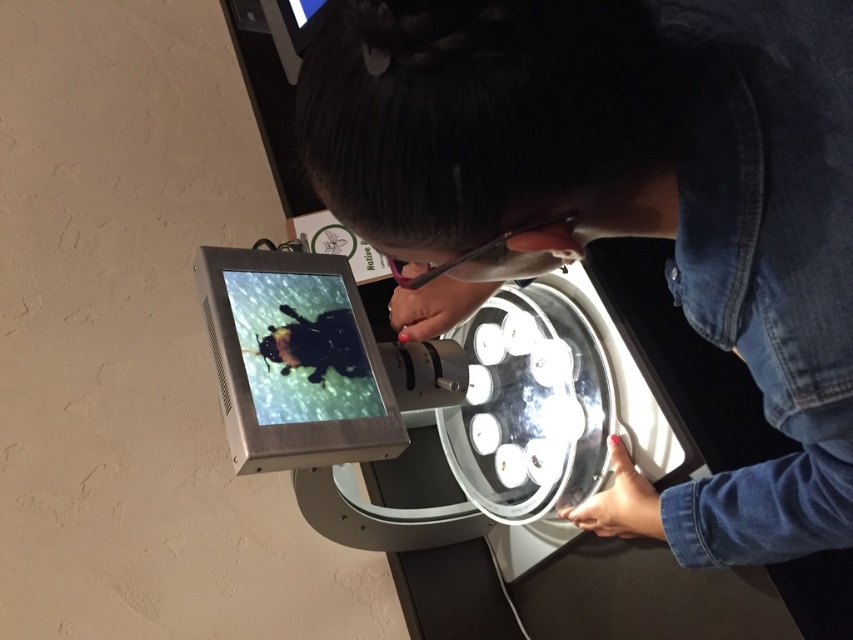
Question: Considering the relative positions of denim jacket at center and matte black screen at center in the image provided, where is denim jacket at center located with respect to matte black screen at center?

Choices:
 (A) below
 (B) above

Answer: (B)

Question: Can you confirm if denim jacket at center is positioned to the right of matte black screen at center?

Choices:
 (A) yes
 (B) no

Answer: (A)

Question: Can you confirm if denim jacket at center is positioned to the right of matte black screen at center?

Choices:
 (A) no
 (B) yes

Answer: (B)